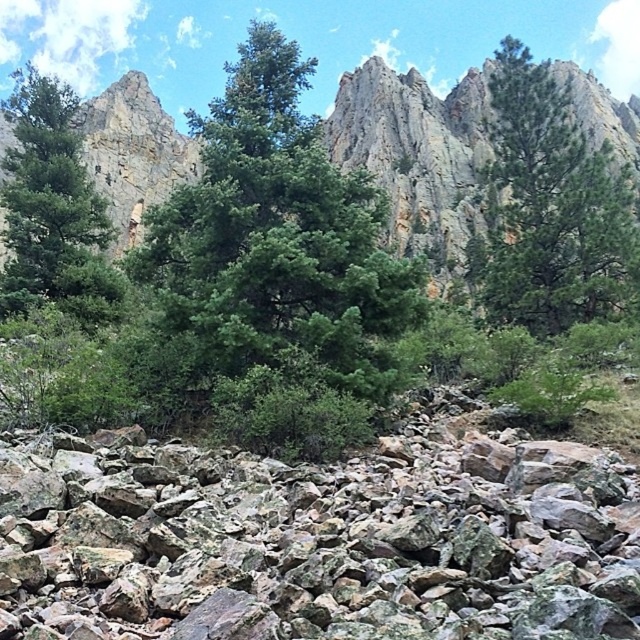
Consider the image. You are a hiker who needs to cross from the gray rough rocks at center to the green matte tree at left. Given that your average walking pace is 3 feet per second, how many seconds will it take you to reach the tree?

The distance between the gray rough rocks at center and the green matte tree at left is 89.89 feet. At a pace of 3 feet per second, dividing 89.89 by 3 gives approximately 30 seconds. So, it will take about 30 seconds to reach the tree.

You are navigating through a rocky landscape and need to place a small weather station. The weather station requires a flat area at the center of the scene. Are the gray rough rocks at center suitable for this purpose?

The gray rough rocks at center are located at point (320, 540), which corresponds to the center of the scene. However, the description mentions the rocks are scattered and vary in size and shape, creating a textured surface. This suggests the area might not be flat enough for a weather station requiring a flat area.

You are navigating a drone through the rugged landscape shown in the image. You need to fly from the scattered rocks and boulders in the foreground to the green leafy tree at center. Based on the coordinates provided, what direction should the drone take relative to the current position?

The green leafy tree at center is located at coordinates point (276, 266), so the drone should fly towards the center of the image to reach it.